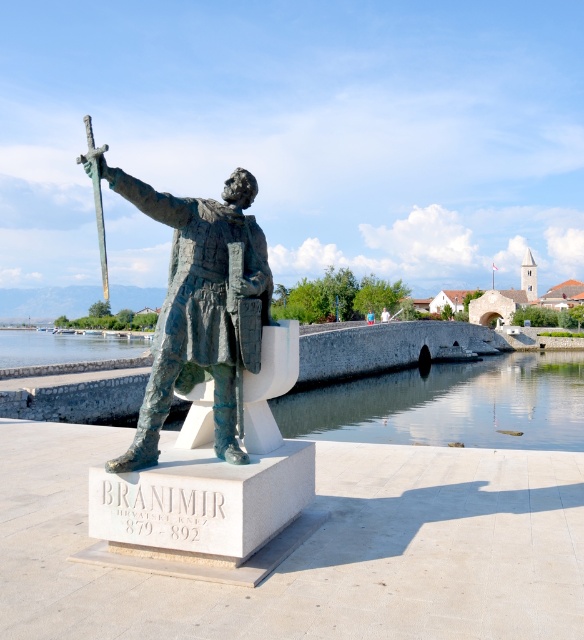
Question: Can you confirm if bronze statue at center is positioned above bronze metallic sword at center?

Choices:
 (A) yes
 (B) no

Answer: (B)

Question: Is bronze statue at center wider than bronze metallic sword at center?

Choices:
 (A) no
 (B) yes

Answer: (A)

Question: Based on their relative distances, which object is farther from the clear water at statue right?

Choices:
 (A) bronze metallic sword at center
 (B) bronze statue at center

Answer: (A)

Question: Is clear water at statue right above bronze statue at center?

Choices:
 (A) yes
 (B) no

Answer: (B)

Question: Estimate the real-world distances between objects in this image. Which object is closer to the bronze metallic sword at center?

Choices:
 (A) clear water at statue right
 (B) bronze statue at center

Answer: (B)

Question: Which object is positioned farthest from the clear water at statue right?

Choices:
 (A) bronze statue at center
 (B) bronze metallic sword at center

Answer: (B)